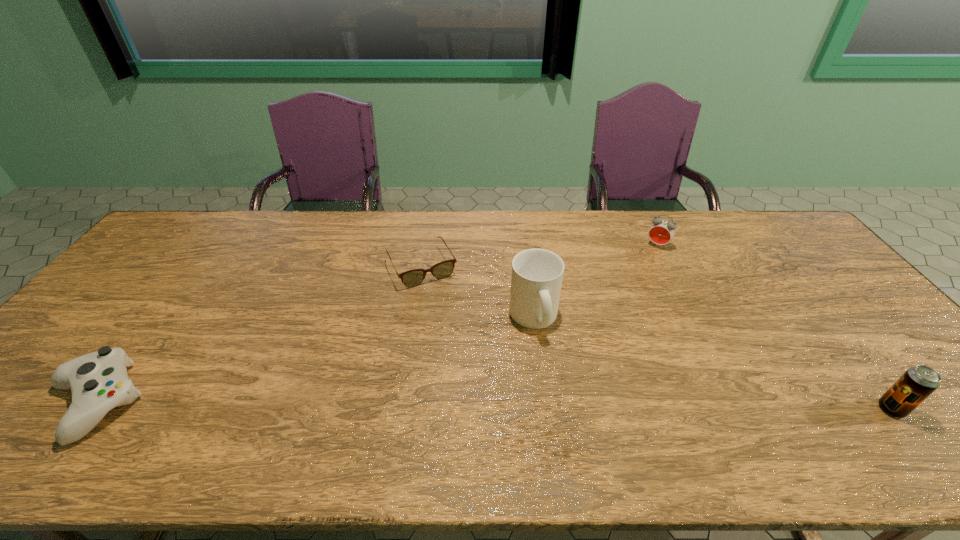
The height and width of the screenshot is (540, 960). In order to click on control in this screenshot , I will do `click(98, 381)`.

You are a GUI agent. You are given a task and a screenshot of the screen. Output one action in this format:
    pyautogui.click(x=<x>, y=<y>)
    Task: Click on the second shortest object
    This screenshot has height=540, width=960.
    Given the screenshot: What is the action you would take?
    pyautogui.click(x=98, y=381)

Locate an element on the screen. This screenshot has width=960, height=540. beer can is located at coordinates (918, 382).

At what (x,y) coordinates should I click in order to perform the action: click on the fourth object from left to right. Please return your answer as a coordinate pair (x, y). The image size is (960, 540). Looking at the image, I should click on (661, 232).

At what (x,y) coordinates should I click in order to perform the action: click on the fourth object from right to left. Please return your answer as a coordinate pair (x, y). Looking at the image, I should click on (412, 278).

Identify the location of spectacles. (412, 278).

Identify the location of mug. [x=537, y=274].

Where is `the third farthest object`? This screenshot has height=540, width=960. the third farthest object is located at coordinates pyautogui.click(x=537, y=274).

Locate an element on the screen. Image resolution: width=960 pixels, height=540 pixels. vacant space located 0.110m on the right of the control is located at coordinates (190, 402).

At what (x,y) coordinates should I click in order to perform the action: click on vacant space located on the right of the rightmost object. Please return your answer as a coordinate pair (x, y). The width and height of the screenshot is (960, 540). Looking at the image, I should click on click(x=947, y=409).